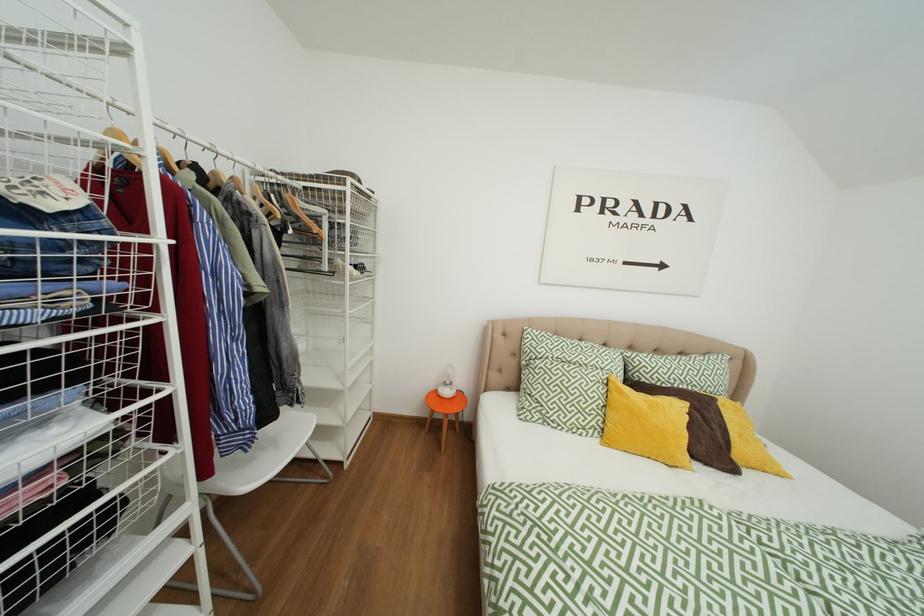
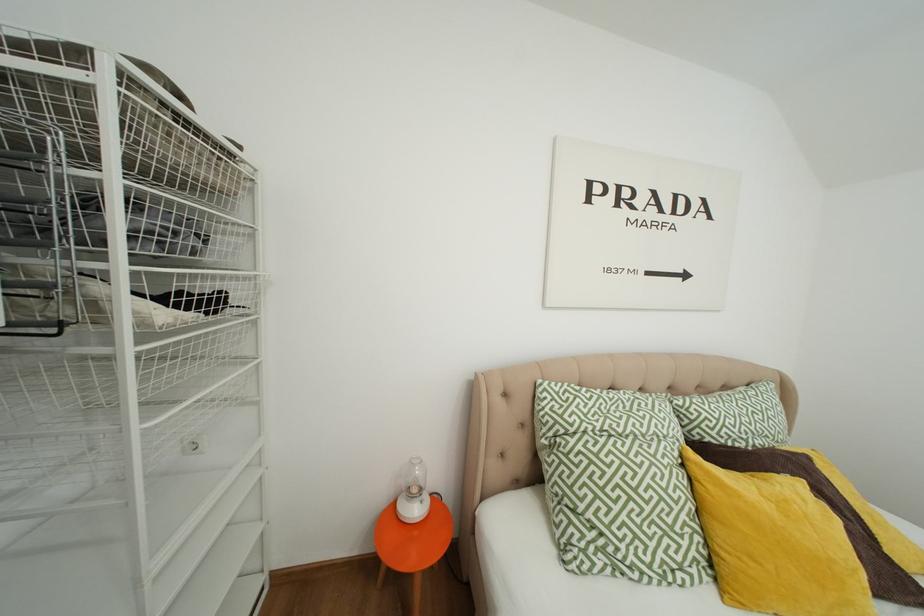
Question: The camera is either moving clockwise (left) or counter-clockwise (right) around the object. The first image is from the beginning of the video and the second image is from the end. Is the camera moving left or right when shooting the video?

Choices:
 (A) Left
 (B) Right

Answer: (A)